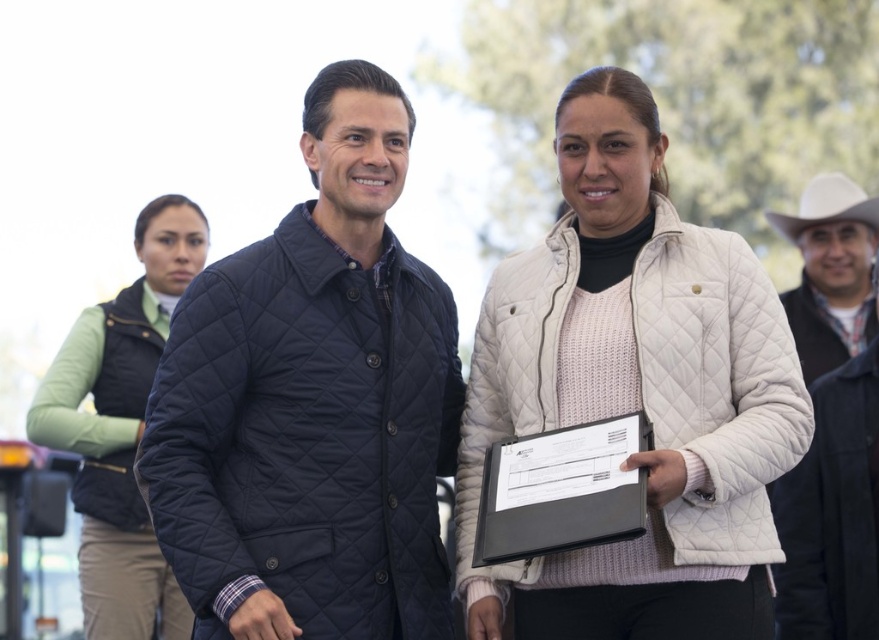
You are standing at the center of the image and want to hand a document to the person wearing the white quilted jacket at right. In which direction should you move to approach them?

The white quilted jacket at right is located at point 0.617 on the x axis and 0.941 on the y axis, so you should move to the right and slightly downward to reach them.